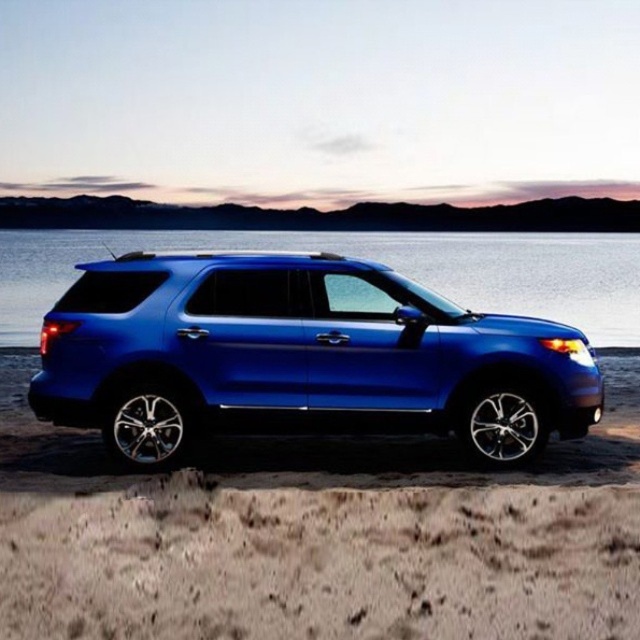
You are a photographer trying to capture the metallic blue suv at center and the blue metallic water at center in a single shot. Which object will appear larger in the photo?

The blue metallic water at center will appear larger in the photo because the metallic blue suv at center is smaller than blue metallic water at center.

You are standing on the beach looking at the SUV. There are two points marked on the image. The first point is at coordinate point (x=552, y=513) and the second is at point (x=324, y=406). If you were to walk towards the SUV, which point would you encounter first?

The point at coordinate point (x=552, y=513) is closer to the viewer than point (x=324, y=406), so you would encounter it first when walking towards the SUV.